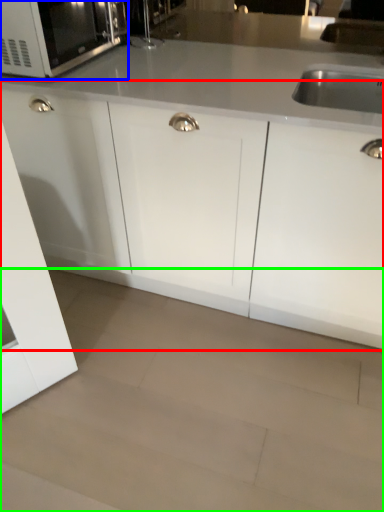
Question: Which object is positioned closest to cabinetry (highlighted by a red box)? Select from microwave oven (highlighted by a blue box) and granite (highlighted by a green box).

Choices:
 (A) microwave oven
 (B) granite

Answer: (B)